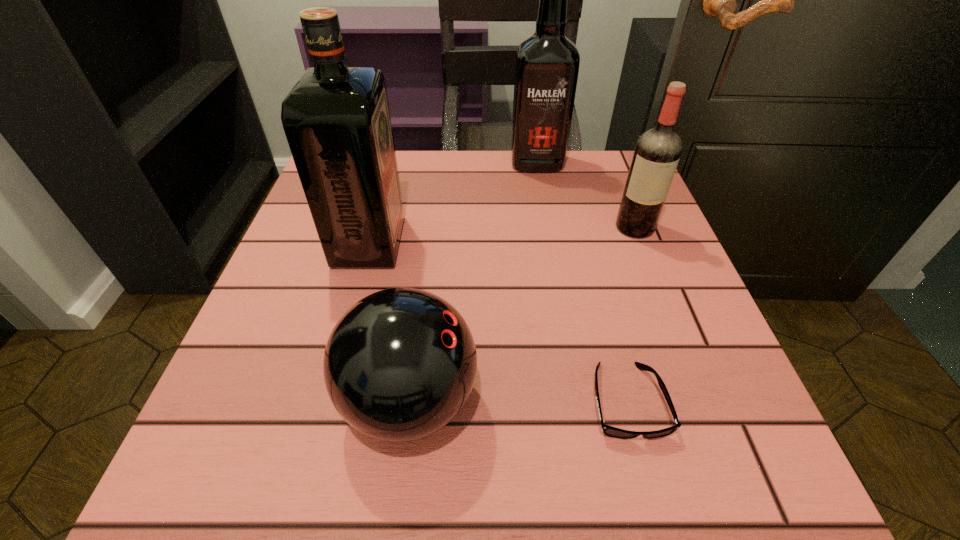
What are the coordinates of `the second liquor from left to right` in the screenshot? It's located at (547, 64).

The width and height of the screenshot is (960, 540). I want to click on the farthest object, so click(x=547, y=64).

I want to click on the leftmost liquor, so click(336, 119).

At what (x,y) coordinates should I click in order to perform the action: click on the rightmost liquor. Please return your answer as a coordinate pair (x, y). Looking at the image, I should click on (657, 152).

Identify the location of the shortest liquor. (657, 152).

At what (x,y) coordinates should I click in order to perform the action: click on bowling ball. Please return your answer as a coordinate pair (x, y). Looking at the image, I should click on (399, 365).

Identify the location of the shortest object. This screenshot has width=960, height=540. (609, 431).

In order to click on free space located on the front-facing side of the farthest object in this screenshot , I will do `click(542, 197)`.

Find the location of a particular element. The image size is (960, 540). vacant space located on the front label of the leftmost liquor is located at coordinates (503, 242).

Locate an element on the screen. This screenshot has width=960, height=540. free space located 0.130m on the front-facing side of the third tallest object is located at coordinates (659, 288).